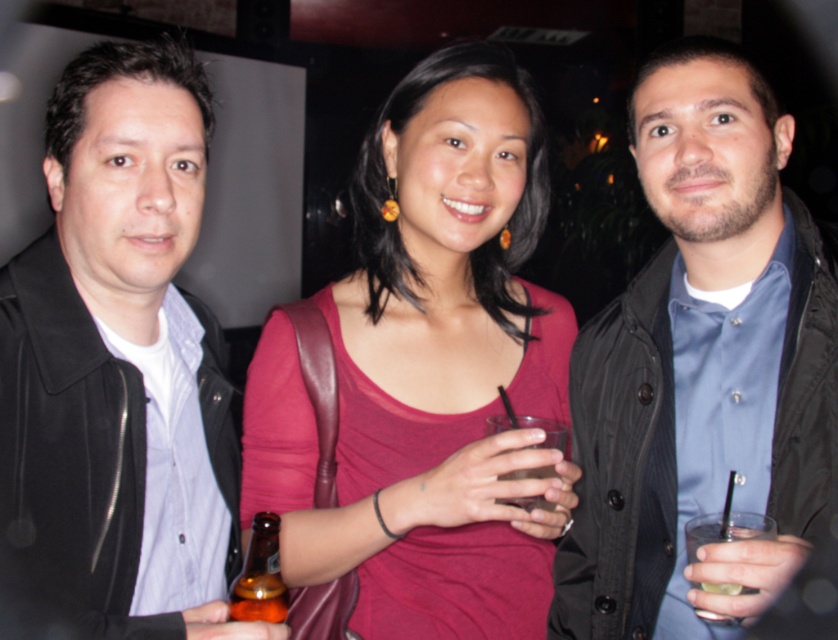
Question: Can you confirm if matte pink tank top at center is positioned to the right of black leather jacket at left?

Choices:
 (A) yes
 (B) no

Answer: (A)

Question: Can you confirm if matte black jacket at center is positioned to the right of brown glass bottle at center?

Choices:
 (A) yes
 (B) no

Answer: (A)

Question: Among these points, which one is nearest to the camera?

Choices:
 (A) (542, 468)
 (B) (692, 525)

Answer: (B)

Question: Which object appears closest to the camera in this image?

Choices:
 (A) clear glass at right
 (B) clear glass at center
 (C) black leather jacket at left
 (D) matte pink tank top at center

Answer: (A)

Question: Which point is farther to the camera?

Choices:
 (A) matte pink tank top at center
 (B) brown glass bottle at center
 (C) matte black jacket at center
 (D) black leather jacket at left

Answer: (B)

Question: Considering the relative positions of matte pink tank top at center and brown glass bottle at center in the image provided, where is matte pink tank top at center located with respect to brown glass bottle at center?

Choices:
 (A) right
 (B) left

Answer: (A)